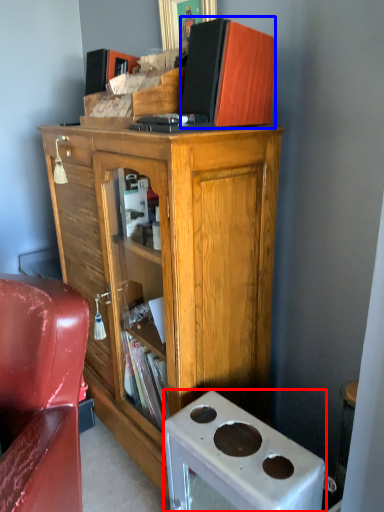
Question: Among these objects, which one is farthest to the camera, desk (highlighted by a red box) or book (highlighted by a blue box)?

Choices:
 (A) desk
 (B) book

Answer: (B)